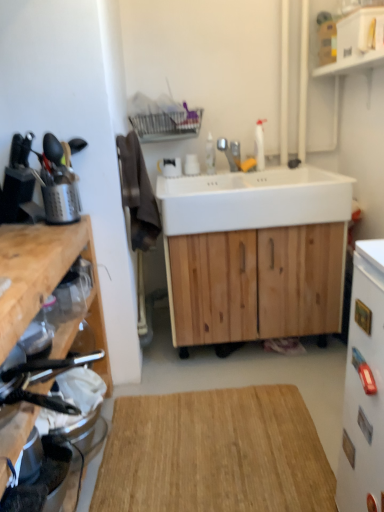
You are a GUI agent. You are given a task and a screenshot of the screen. Output one action in this format:
    pyautogui.click(x=<x>, y=<y>)
    Task: Click on the free area behind natural wood cutting board at center
    
    Given the screenshot: What is the action you would take?
    pyautogui.click(x=213, y=368)